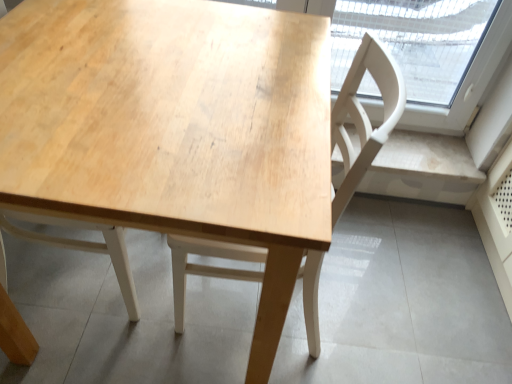
Question: Is natural wood table at center taller or shorter than light wood chair at center?

Choices:
 (A) tall
 (B) short

Answer: (B)

Question: Visually, is natural wood table at center positioned to the left or to the right of light wood chair at center?

Choices:
 (A) right
 (B) left

Answer: (B)

Question: Is natural wood table at center wider or thinner than light wood chair at center?

Choices:
 (A) wide
 (B) thin

Answer: (A)

Question: Would you say light wood chair at center is to the left or to the right of natural wood table at center in the picture?

Choices:
 (A) left
 (B) right

Answer: (B)

Question: Considering the positions of point (391, 72) and point (24, 69), is point (391, 72) closer or farther from the camera than point (24, 69)?

Choices:
 (A) farther
 (B) closer

Answer: (A)

Question: Looking at their shapes, would you say light wood chair at center is wider or thinner than natural wood table at center?

Choices:
 (A) wide
 (B) thin

Answer: (B)

Question: In terms of size, does light wood chair at center appear bigger or smaller than natural wood table at center?

Choices:
 (A) small
 (B) big

Answer: (A)